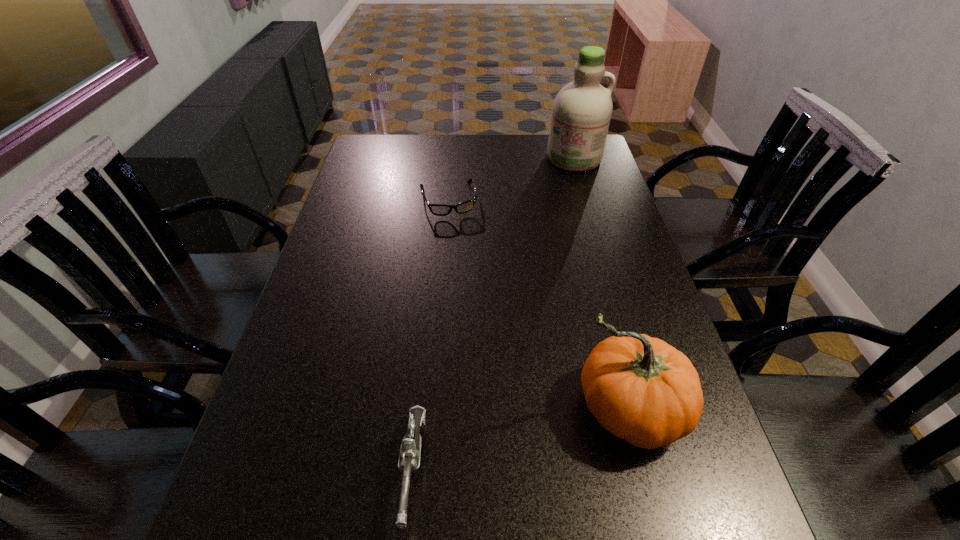
The height and width of the screenshot is (540, 960). In order to click on vacant space located on the front-facing side of the third nearest object in this screenshot , I will do `click(458, 242)`.

Locate an element on the screen. The width and height of the screenshot is (960, 540). free space located on the front-facing side of the third nearest object is located at coordinates (468, 286).

At what (x,y) coordinates should I click in order to perform the action: click on free space located on the front-facing side of the third nearest object. Please return your answer as a coordinate pair (x, y). Looking at the image, I should click on (465, 267).

Find the location of a particular element. object present at the far edge is located at coordinates (582, 109).

Identify the location of gun that is at the near edge. (409, 459).

You are a GUI agent. You are given a task and a screenshot of the screen. Output one action in this format:
    pyautogui.click(x=<x>, y=<y>)
    Task: Click on the pumpkin located in the near edge section of the desktop
    
    Given the screenshot: What is the action you would take?
    pyautogui.click(x=641, y=389)

Locate an element on the screen. pumpkin that is at the right edge is located at coordinates (641, 389).

The width and height of the screenshot is (960, 540). I want to click on cleansing agent situated at the right edge, so click(x=582, y=109).

Where is `object present at the far right corner`? object present at the far right corner is located at coordinates click(x=582, y=109).

Locate an element on the screen. The height and width of the screenshot is (540, 960). object that is at the near right corner is located at coordinates (641, 389).